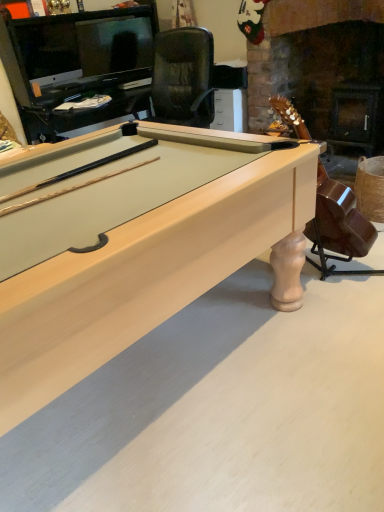
Measure the distance between point (283, 116) and camera.

Point (283, 116) and camera are 1.68 meters apart from each other.

The width and height of the screenshot is (384, 512). What do you see at coordinates (338, 221) in the screenshot?
I see `matte brown guitar at center-right` at bounding box center [338, 221].

Locate an element on the screen. matte brown guitar at center-right is located at coordinates (338, 221).

Find the location of a particular element. light wood billiard table at center is located at coordinates (129, 242).

Describe the element at coordinates (129, 242) in the screenshot. I see `light wood billiard table at center` at that location.

This screenshot has height=512, width=384. In order to click on matte brown guitar at center-right in this screenshot , I will do `click(338, 221)`.

Which is more to the left, matte brown guitar at center-right or light wood billiard table at center?

light wood billiard table at center is more to the left.

Consider the image. Which object is closer to the camera, matte brown guitar at center-right or light wood billiard table at center?

light wood billiard table at center.

Does point (325, 183) come in front of point (170, 131)?

No, it is not.

From the image's perspective, between matte brown guitar at center-right and light wood billiard table at center, who is located below?

light wood billiard table at center appears lower in the image.

From a real-world perspective, which is physically above, matte brown guitar at center-right or light wood billiard table at center?

matte brown guitar at center-right.

Does matte brown guitar at center-right have a lesser width compared to light wood billiard table at center?

Yes, matte brown guitar at center-right is thinner than light wood billiard table at center.

Who is shorter, matte brown guitar at center-right or light wood billiard table at center?

With less height is light wood billiard table at center.

Considering the relative sizes of matte brown guitar at center-right and light wood billiard table at center in the image provided, is matte brown guitar at center-right bigger than light wood billiard table at center?

Actually, matte brown guitar at center-right might be smaller than light wood billiard table at center.

Is matte brown guitar at center-right surrounding light wood billiard table at center?

No.

Is matte brown guitar at center-right far from light wood billiard table at center?

matte brown guitar at center-right is near light wood billiard table at center, not far away.

Is matte brown guitar at center-right aimed at light wood billiard table at center?

No, matte brown guitar at center-right does not turn towards light wood billiard table at center.

This screenshot has height=512, width=384. I want to click on billiard table on the left of matte brown guitar at center-right, so click(129, 242).

Between light wood billiard table at center and matte brown guitar at center-right, which one appears on the left side from the viewer's perspective?

light wood billiard table at center is more to the left.

Is the position of light wood billiard table at center less distant than that of matte brown guitar at center-right?

Yes, light wood billiard table at center is in front of matte brown guitar at center-right.

Is point (86, 145) farther from viewer compared to point (342, 225)?

Yes, it is behind point (342, 225).

From the image's perspective, is light wood billiard table at center on matte brown guitar at center-right?

Incorrect, from the image's perspective, light wood billiard table at center is lower than matte brown guitar at center-right.

From a real-world perspective, is light wood billiard table at center physically above matte brown guitar at center-right?

Incorrect, from a real-world perspective, light wood billiard table at center is lower than matte brown guitar at center-right.

Does light wood billiard table at center have a lesser width compared to matte brown guitar at center-right?

No.

From their relative heights in the image, would you say light wood billiard table at center is taller or shorter than matte brown guitar at center-right?

Considering their sizes, light wood billiard table at center has less height than matte brown guitar at center-right.

Can you confirm if light wood billiard table at center is smaller than matte brown guitar at center-right?

Incorrect, light wood billiard table at center is not smaller in size than matte brown guitar at center-right.

Is matte brown guitar at center-right inside light wood billiard table at center?

No, matte brown guitar at center-right is located outside of light wood billiard table at center.

Is light wood billiard table at center far from matte brown guitar at center-right?

No, light wood billiard table at center is in close proximity to matte brown guitar at center-right.

Is light wood billiard table at center facing towards matte brown guitar at center-right?

No.

The width and height of the screenshot is (384, 512). Find the location of `billiard table that appears below the matte brown guitar at center-right (from the image's perspective)`. billiard table that appears below the matte brown guitar at center-right (from the image's perspective) is located at coordinates (129, 242).

Where is `guitar located above the light wood billiard table at center (from a real-world perspective)`? guitar located above the light wood billiard table at center (from a real-world perspective) is located at coordinates coord(338,221).

The width and height of the screenshot is (384, 512). I want to click on guitar lying above the light wood billiard table at center (from the image's perspective), so click(338, 221).